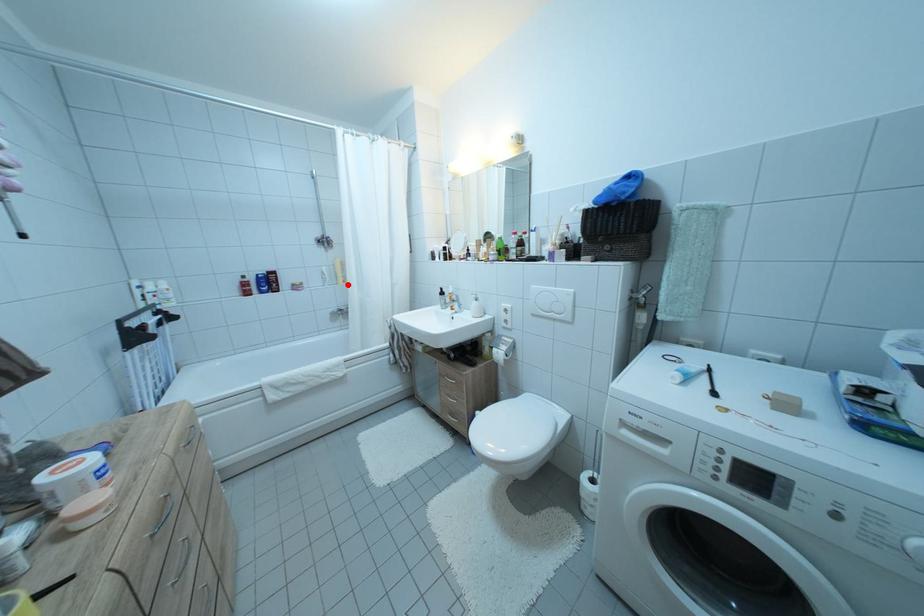
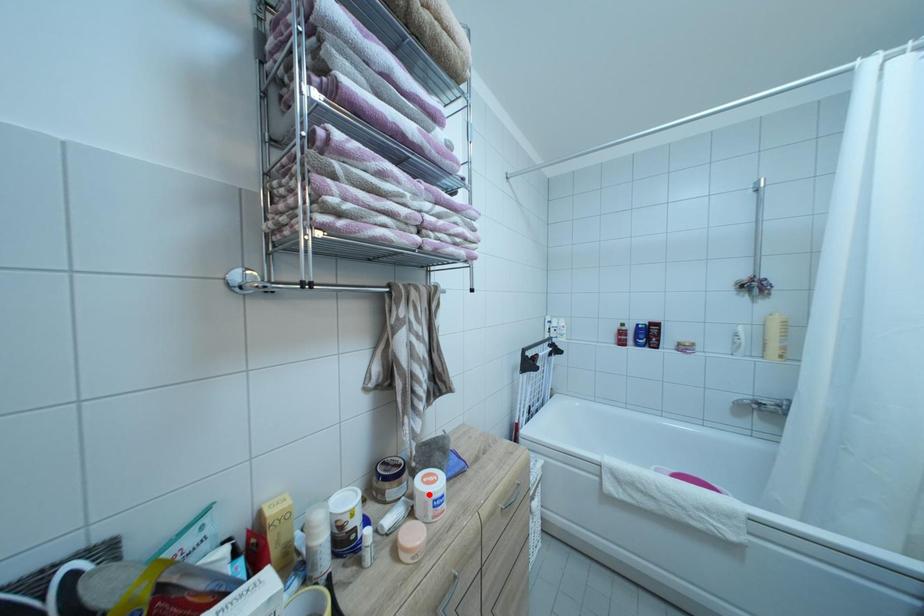
I am providing you with two images of the same scene from different viewpoints. A red point is marked on the first image and another point is marked on the second image. Does the point marked in image1 correspond to the same location as the one in image2?

No